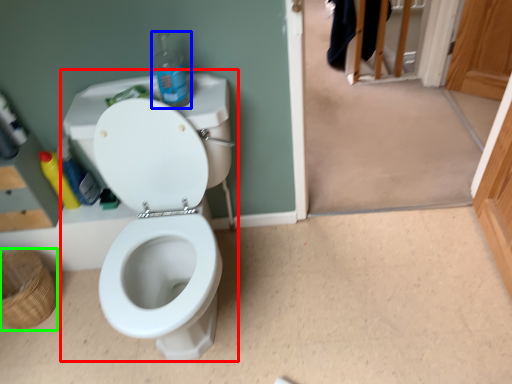
Question: Considering the real-world distances, which object is closest to sink (highlighted by a red box)? bottle (highlighted by a blue box) or basket (highlighted by a green box).

Choices:
 (A) bottle
 (B) basket

Answer: (A)